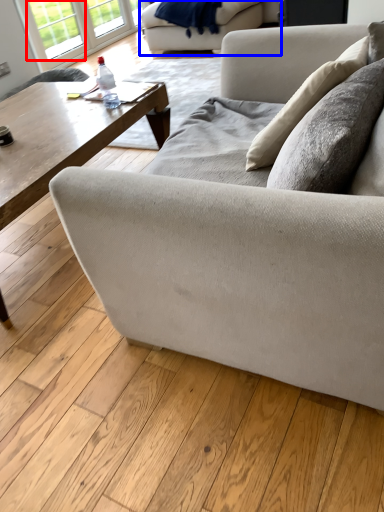
Question: Which point is closer to the camera, window (highlighted by a red box) or studio couch (highlighted by a blue box)?

Choices:
 (A) window
 (B) studio couch

Answer: (B)